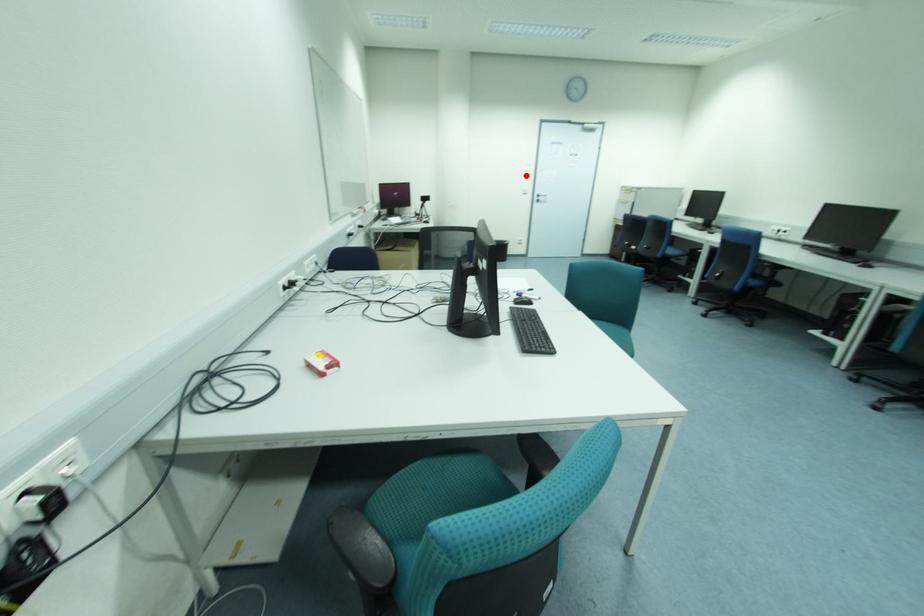
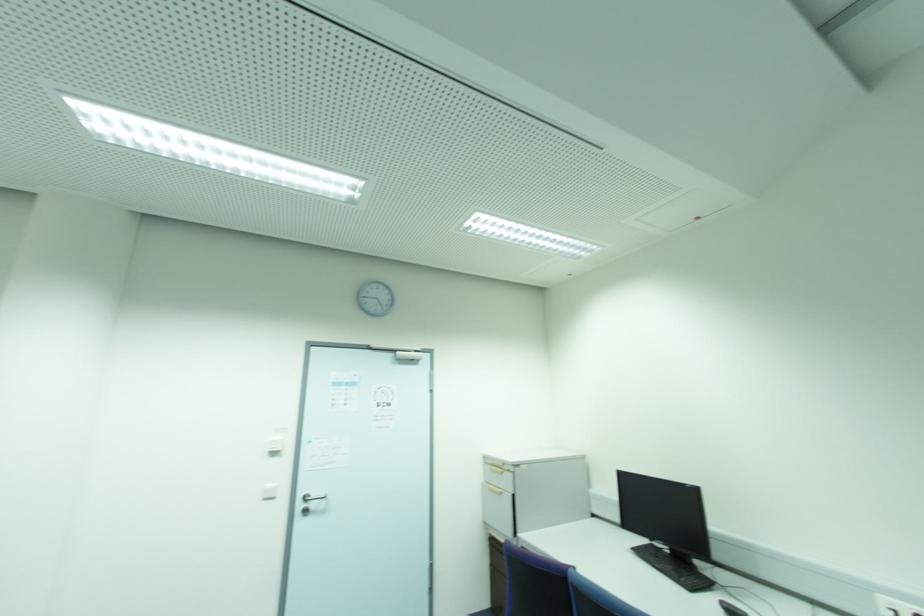
In the second image, find the point that corresponds to the highlighted location in the first image.

(274, 454)